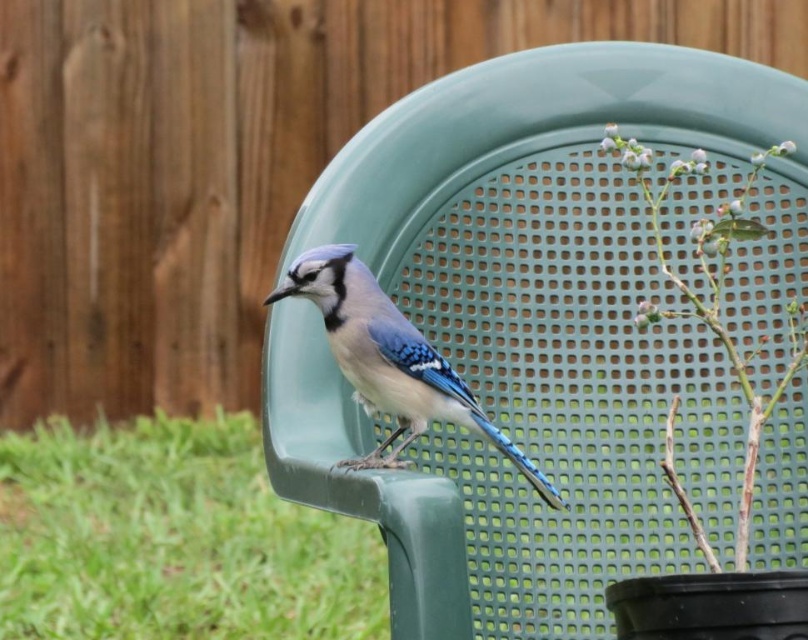
Between blue glossy bird at center and green matte plant at center right, which one has less height?

Standing shorter between the two is blue glossy bird at center.

Is blue glossy bird at center taller than green matte plant at center right?

No.

What do you see at coordinates (390, 360) in the screenshot?
I see `blue glossy bird at center` at bounding box center [390, 360].

Identify the location of blue glossy bird at center. Image resolution: width=808 pixels, height=640 pixels. (390, 360).

From the picture: Can you confirm if green plastic chair at center is positioned to the left of blue glossy bird at center?

Indeed, green plastic chair at center is positioned on the left side of blue glossy bird at center.

Is the position of green plastic chair at center more distant than that of blue glossy bird at center?

That is True.

The image size is (808, 640). Describe the element at coordinates (171, 538) in the screenshot. I see `green plastic chair at center` at that location.

Locate an element on the screen. The image size is (808, 640). green plastic chair at center is located at coordinates (171, 538).

Is green plastic chair at center to the left of green matte plant at center right from the viewer's perspective?

Yes, green plastic chair at center is to the left of green matte plant at center right.

Is point (95, 566) positioned behind point (670, 406)?

Yes, point (95, 566) is behind point (670, 406).

Locate an element on the screen. green plastic chair at center is located at coordinates click(171, 538).